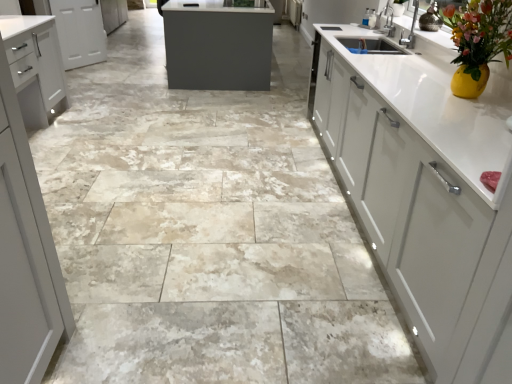
Question: Looking at their shapes, would you say white matte cabinet at upper left, the 2th cabinetry when ordered from front to back, is wider or thinner than white matte cabinet at left, arranged as the first cabinetry when ordered from the bottom?

Choices:
 (A) wide
 (B) thin

Answer: (B)

Question: Is point (60, 1) positioned closer to the camera than point (62, 74)?

Choices:
 (A) closer
 (B) farther

Answer: (B)

Question: From a real-world perspective, is white matte cabinet at upper left, which is the 1th cabinetry from back to front, physically located above or below white matte cabinet at left, the 2th cabinetry positioned from the back?

Choices:
 (A) below
 (B) above

Answer: (A)

Question: In terms of height, does white matte cabinet at left, the first cabinetry viewed from the front, look taller or shorter compared to white matte cabinet at upper left, which ranks as the 1th cabinetry in top-to-bottom order?

Choices:
 (A) short
 (B) tall

Answer: (B)

Question: Considering the positions of white matte cabinet at left, the first cabinetry viewed from the front, and white matte cabinet at upper left, which appears as the second cabinetry when ordered from the bottom, in the image, is white matte cabinet at left, the first cabinetry viewed from the front, wider or thinner than white matte cabinet at upper left, which appears as the second cabinetry when ordered from the bottom,?

Choices:
 (A) thin
 (B) wide

Answer: (B)

Question: From the image's perspective, is white matte cabinet at left, the first cabinetry viewed from the front, above or below white matte cabinet at upper left, which ranks as the 1th cabinetry in top-to-bottom order?

Choices:
 (A) above
 (B) below

Answer: (B)

Question: Relative to white matte cabinet at upper left, which ranks as the 1th cabinetry in top-to-bottom order, is white matte cabinet at left, the 2th cabinetry positioned from the back, in front or behind?

Choices:
 (A) front
 (B) behind

Answer: (A)